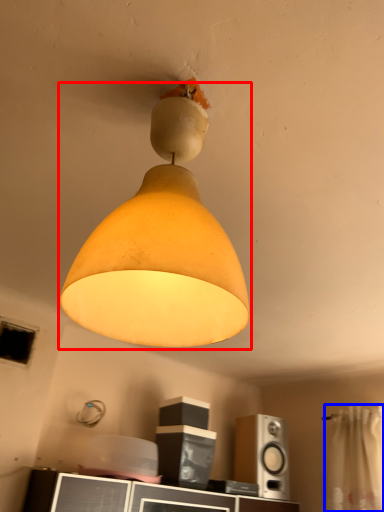
Question: Among these objects, which one is nearest to the camera, lamp (highlighted by a red box) or curtain (highlighted by a blue box)?

Choices:
 (A) lamp
 (B) curtain

Answer: (A)